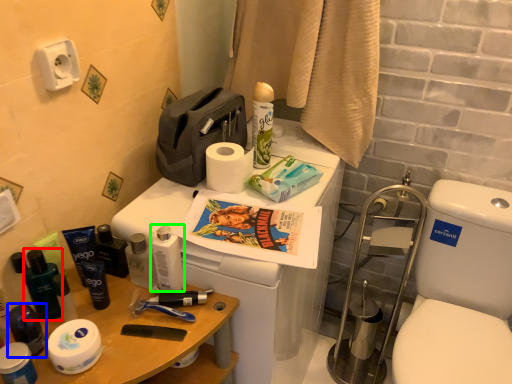
Question: Which object is positioned closest to toiletry (highlighted by a red box)? Select from toiletry (highlighted by a blue box) and toiletry (highlighted by a green box).

Choices:
 (A) toiletry
 (B) toiletry

Answer: (A)